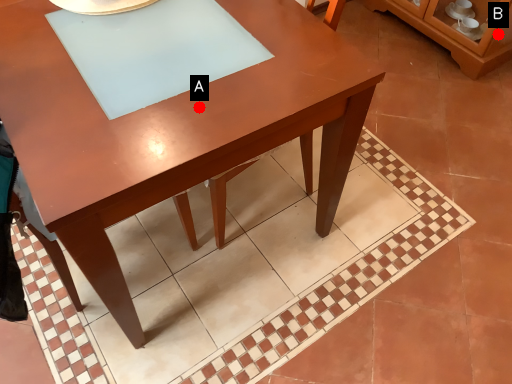
Question: Two points are circled on the image, labeled by A and B beside each circle. Which point is farther from the camera taking this photo?

Choices:
 (A) A is further
 (B) B is further

Answer: (B)